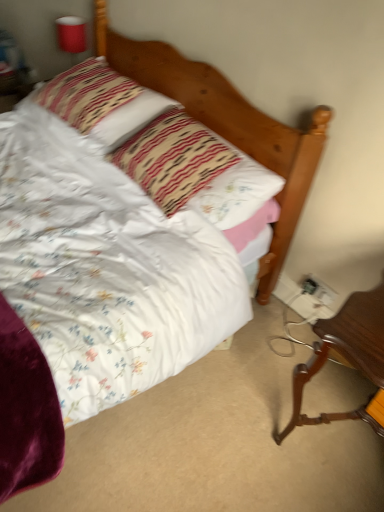
Question: From a real-world perspective, is striped fabric pillow at upper left, acting as the second pillow starting from the front, above or below brown polished wood desk at lower right?

Choices:
 (A) below
 (B) above

Answer: (B)

Question: Is point (144, 98) positioned closer to the camera than point (322, 352)?

Choices:
 (A) closer
 (B) farther

Answer: (B)

Question: Which is farther from the brown polished wood desk at lower right?

Choices:
 (A) striped fabric pillow at upper left, acting as the second pillow starting from the front
 (B) floral fabric pillow at center, the first pillow positioned from the front
 (C) white plastic electrical outlet at lower right, which is the second electric outlet in right-to-left order
 (D) red plastic cup at upper left
 (E) white plastic electric outlet at lower right, which is counted as the second electric outlet, starting from the left

Answer: (D)

Question: Which object is positioned farthest from the white plastic electric outlet at lower right, the 1th electric outlet from the right?

Choices:
 (A) red plastic cup at upper left
 (B) brown polished wood desk at lower right
 (C) floral fabric pillow at center, positioned as the second pillow in back-to-front order
 (D) striped fabric pillow at upper left, acting as the second pillow starting from the front
 (E) white plastic electrical outlet at lower right, arranged as the first electric outlet when viewed from the left

Answer: (A)